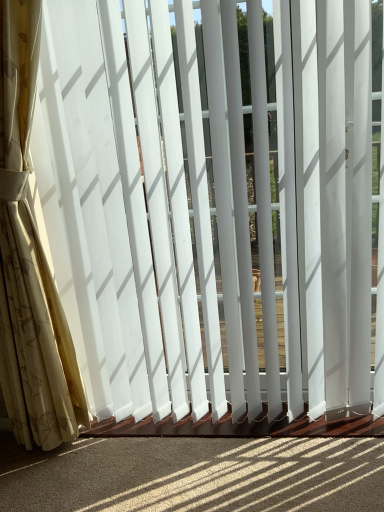
Locate an element on the screen. The width and height of the screenshot is (384, 512). free point in front of white sheer curtain at left is located at coordinates (65, 480).